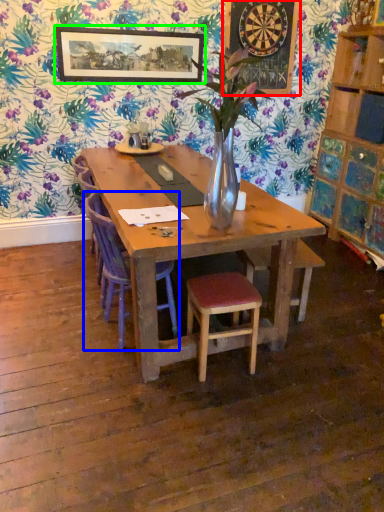
Question: Which object is the farthest from bulletin board (highlighted by a red box)? Choose among these: chair (highlighted by a blue box) or picture frame (highlighted by a green box).

Choices:
 (A) chair
 (B) picture frame

Answer: (A)